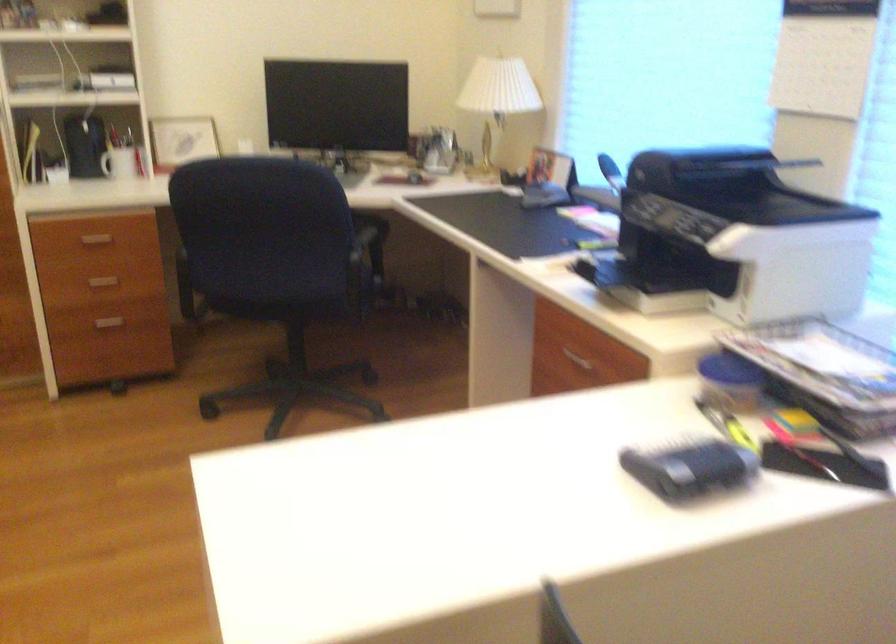
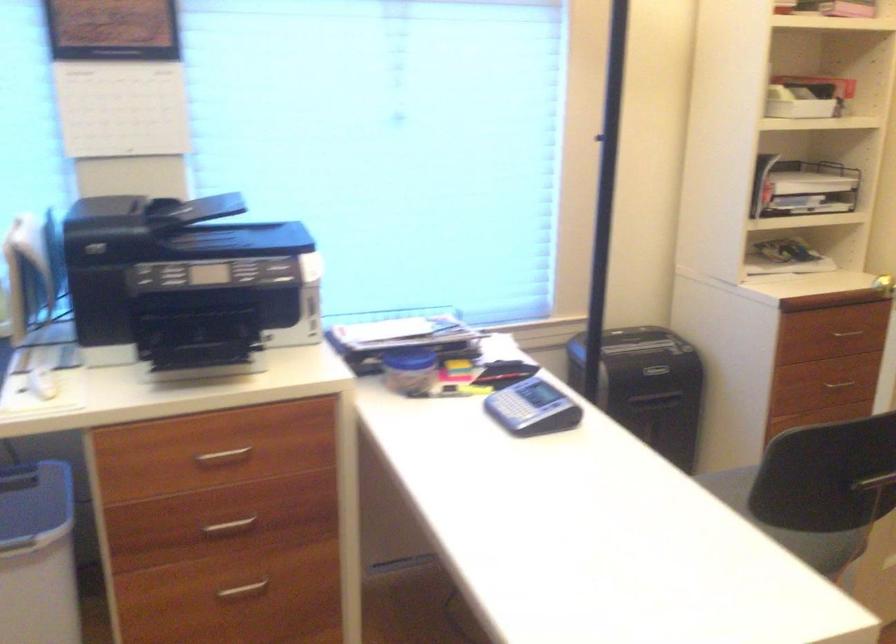
In the second image, find the point that corresponds to [601,368] in the first image.

(222, 457)